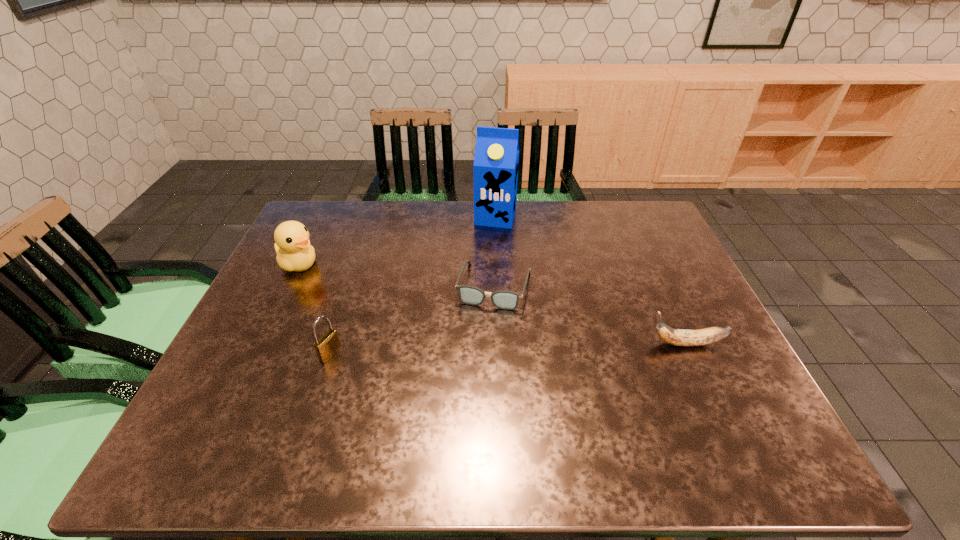
In the image, there is a desktop. Identify the location of free region at the far right corner. This screenshot has height=540, width=960. (648, 226).

Identify the location of free spot at the near right corner of the desktop. The height and width of the screenshot is (540, 960). (763, 411).

Locate an element on the screen. The height and width of the screenshot is (540, 960). empty space between the padlock and the leftmost object is located at coordinates (315, 309).

I want to click on free spot between the spectacles and the padlock, so click(413, 320).

Locate an element on the screen. The width and height of the screenshot is (960, 540). free spot between the padlock and the banana is located at coordinates (509, 349).

The image size is (960, 540). What are the coordinates of `free space that is in between the padlock and the fourth tallest object` in the screenshot? It's located at (509, 349).

This screenshot has height=540, width=960. Identify the location of empty location between the banana and the spectacles. (590, 314).

You are a GUI agent. You are given a task and a screenshot of the screen. Output one action in this format:
    pyautogui.click(x=<x>, y=<y>)
    Task: Click on the free point between the farthest object and the fourth object from right to left
    
    Given the screenshot: What is the action you would take?
    pyautogui.click(x=413, y=285)

Where is `vacant space in between the leftmost object and the fourth object from right to left`? The width and height of the screenshot is (960, 540). vacant space in between the leftmost object and the fourth object from right to left is located at coordinates (315, 309).

You are a GUI agent. You are given a task and a screenshot of the screen. Output one action in this format:
    pyautogui.click(x=<x>, y=<y>)
    Task: Click on the vacant area between the fourth object from right to left and the rightmost object
    
    Given the screenshot: What is the action you would take?
    pyautogui.click(x=509, y=349)